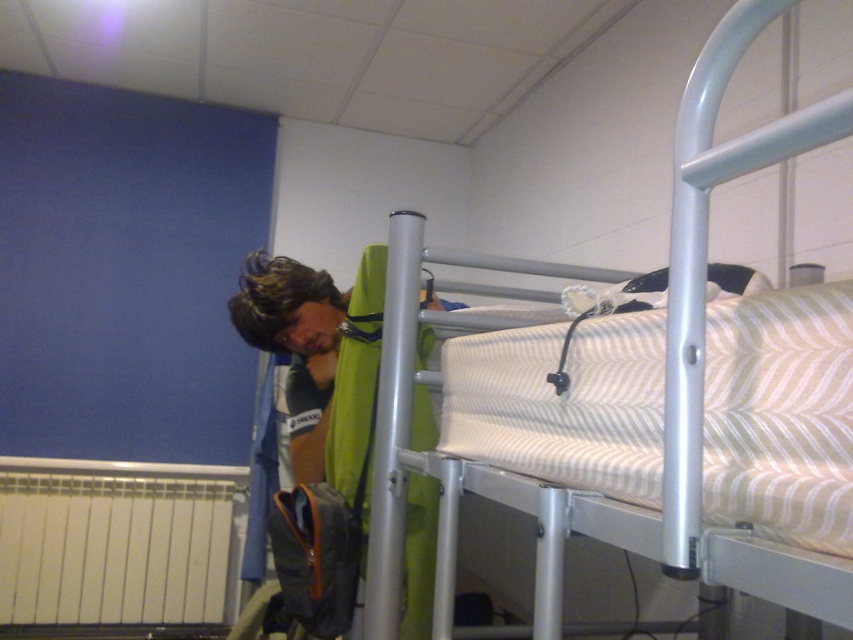
Who is positioned more to the right, metallic silver bunk bed at upper right or green fabric at center?

metallic silver bunk bed at upper right

Describe the element at coordinates (664, 388) in the screenshot. I see `metallic silver bunk bed at upper right` at that location.

Identify the location of metallic silver bunk bed at upper right. (664, 388).